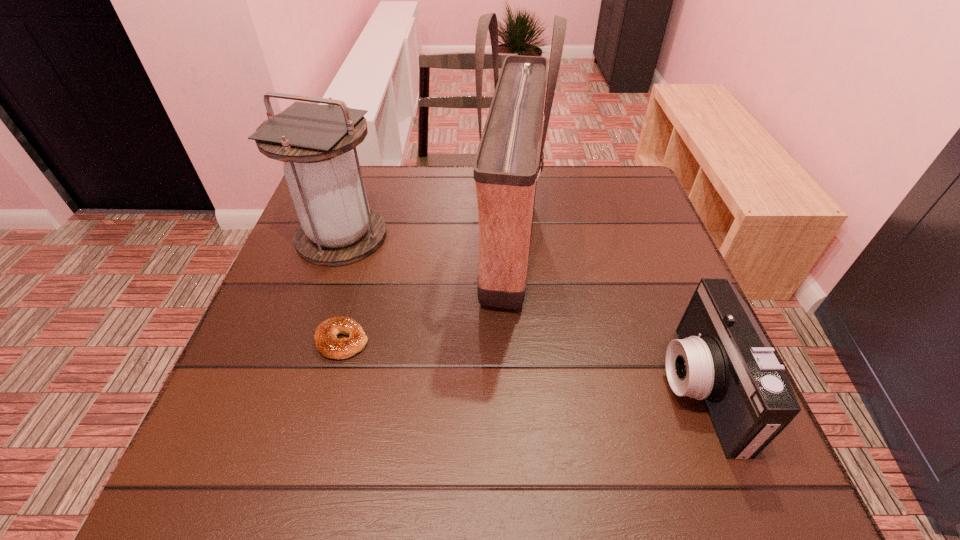
The height and width of the screenshot is (540, 960). What are the coordinates of `vacant space in between the bagel and the shopping bag` in the screenshot? It's located at (426, 295).

You are a GUI agent. You are given a task and a screenshot of the screen. Output one action in this format:
    pyautogui.click(x=<x>, y=<y>)
    Task: Click on the empty space between the shortest object and the shopping bag
    This screenshot has width=960, height=540.
    Given the screenshot: What is the action you would take?
    pyautogui.click(x=426, y=295)

The image size is (960, 540). Find the location of `free space between the third object from left to right and the second shortest object`. free space between the third object from left to right and the second shortest object is located at coordinates click(604, 319).

Identify the location of vacant space that's between the bagel and the rightmost object. (520, 364).

Identify the location of vacant area between the shortest object and the shopping bag. This screenshot has width=960, height=540. (426, 295).

Identify the location of free space between the rightmost object and the second object from right to left. This screenshot has height=540, width=960. (604, 319).

Locate which object ranks in proximity to the bagel. Please provide its 2D coordinates. Your answer should be formatted as a tuple, i.e. [(x, y)], where the tuple contains the x and y coordinates of a point satisfying the conditions above.

[(337, 227)]

Image resolution: width=960 pixels, height=540 pixels. I want to click on object that can be found as the third closest to the tallest object, so coord(337,227).